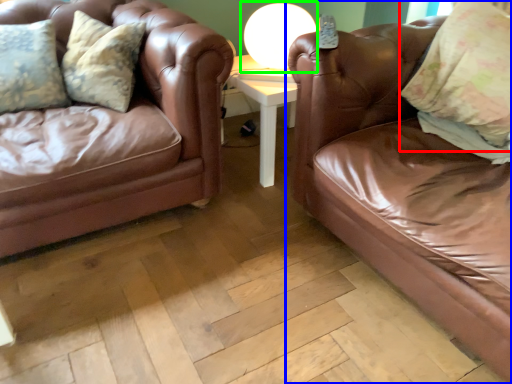
Question: Based on their relative distances, which object is farther from pillow (highlighted by a red box)? Choose from studio couch (highlighted by a blue box) and table lamp (highlighted by a green box).

Choices:
 (A) studio couch
 (B) table lamp

Answer: (B)